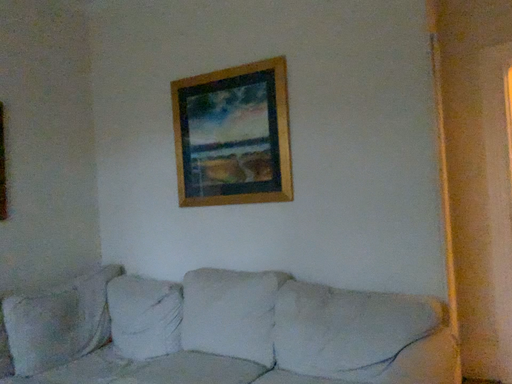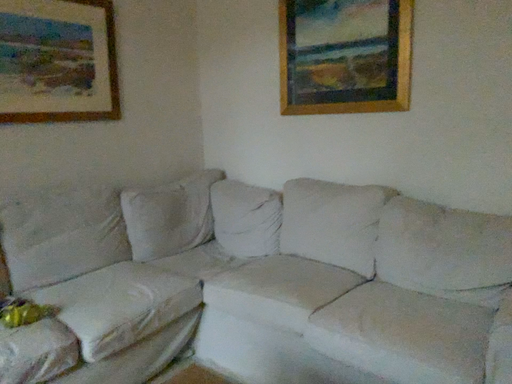
Question: How did the camera likely rotate when shooting the video?

Choices:
 (A) rotated downward
 (B) rotated upward

Answer: (A)